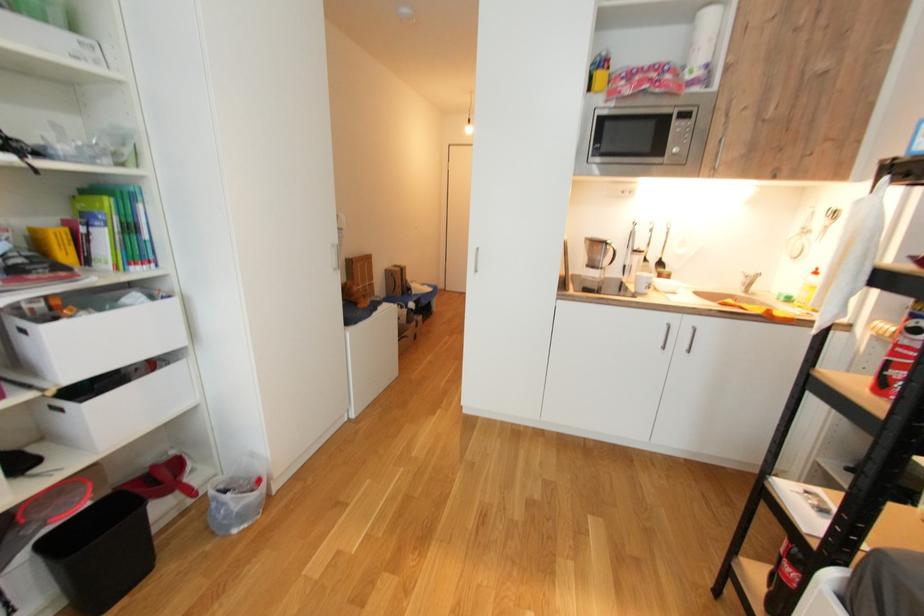
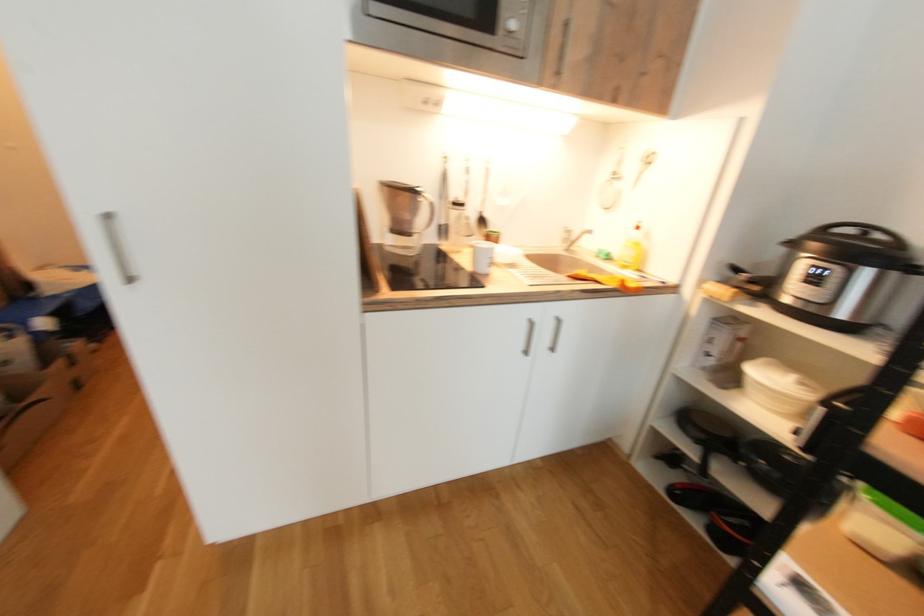
Question: How did the camera likely rotate?

Choices:
 (A) Left
 (B) Right
 (C) Up
 (D) Down

Answer: (B)